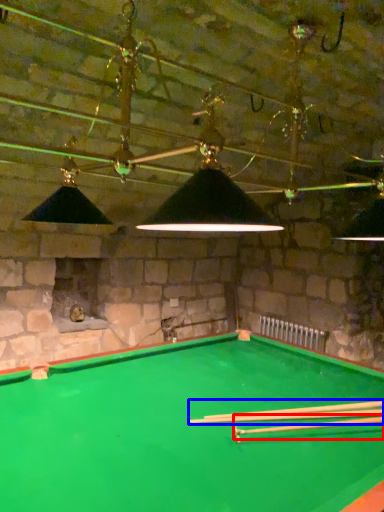
Question: Which of the following is the closest to the observer, cue (highlighted by a red box) or cue (highlighted by a blue box)?

Choices:
 (A) cue
 (B) cue

Answer: (A)